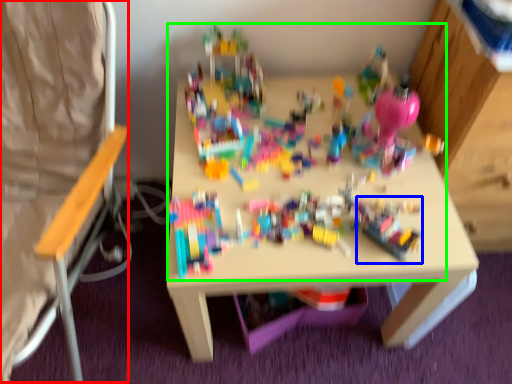
Question: Estimate the real-world distances between objects in this image. Which object is farther from folding chair (highlighted by a red box), toy (highlighted by a blue box) or toy (highlighted by a green box)?

Choices:
 (A) toy
 (B) toy

Answer: (A)